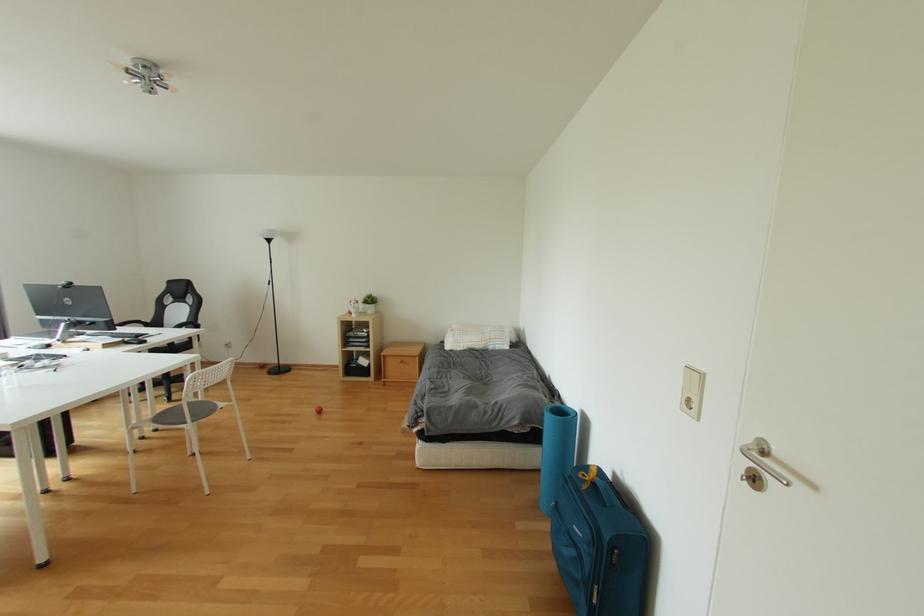
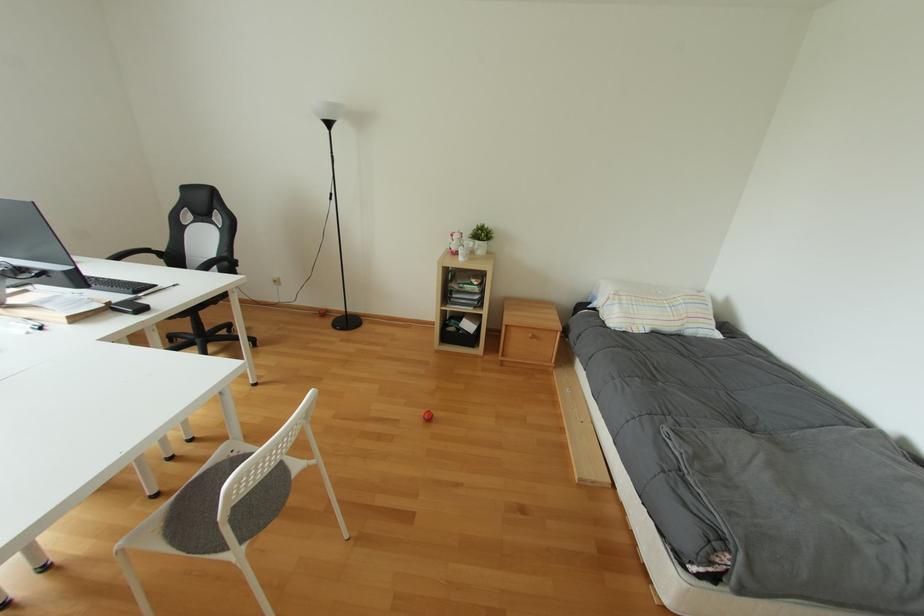
In a continuous first-person perspective shot, in which direction is the camera moving?

The cameraman moved toward left, forward.